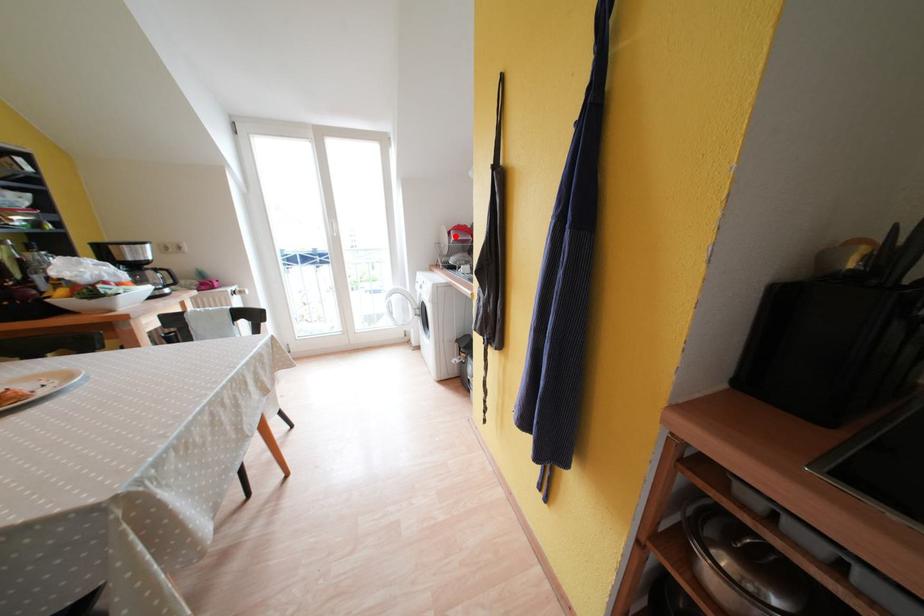
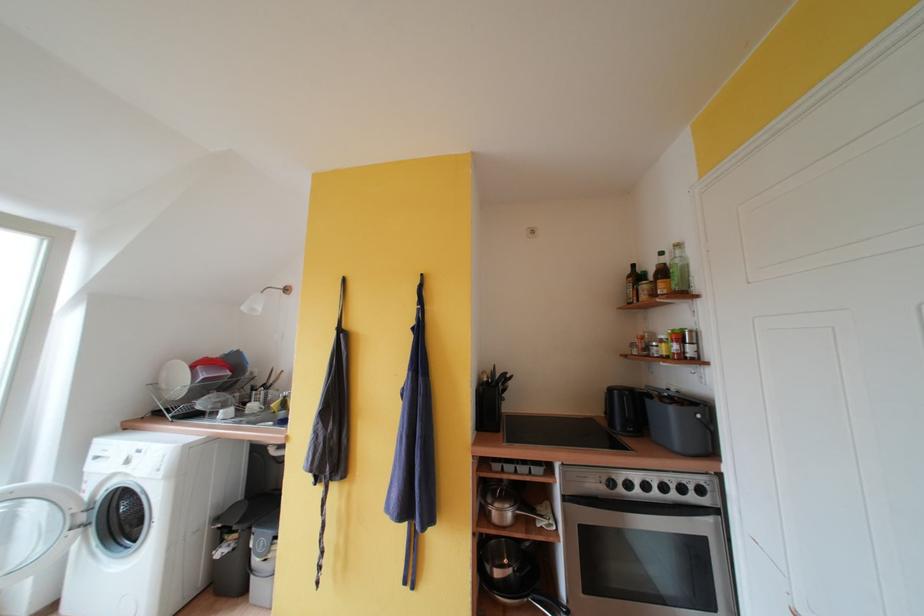
Question: I am providing you with two images of the same scene from different viewpoints. Image1 has a red point marked. In image2, the corresponding 3D location appears at what relative position? Reply with the corresponding letter.

Choices:
 (A) Closer
 (B) Farther

Answer: (B)